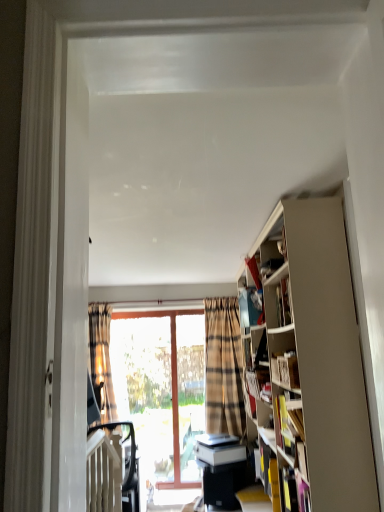
Question: In the image, is white matte bookshelf at right, placed as the first book when sorted from front to back, positioned in front of or behind black glossy table at lower center?

Choices:
 (A) front
 (B) behind

Answer: (A)

Question: From the image's perspective, is white matte bookshelf at right, which is counted as the 2th book, starting from the bottom, above or below black glossy table at lower center?

Choices:
 (A) above
 (B) below

Answer: (A)

Question: Estimate the real-world distances between objects in this image. Which object is farther from the black glossy table at lower center?

Choices:
 (A) black plastic swivel chair at lower left
 (B) clear glass screen door at center
 (C) yellow paper at right, arranged as the second book when viewed from the top
 (D) plaid fabric curtain at left
 (E) white matte bookshelf at right, placed as the first book when sorted from front to back

Answer: (E)

Question: Which object is positioned closest to the black glossy table at lower center?

Choices:
 (A) clear glass screen door at center
 (B) white matte bookshelf at right, arranged as the second book when viewed from the back
 (C) black plastic swivel chair at lower left
 (D) plaid fabric curtain at left
 (E) yellow paper at right, the 1th book in the back-to-front sequence

Answer: (C)